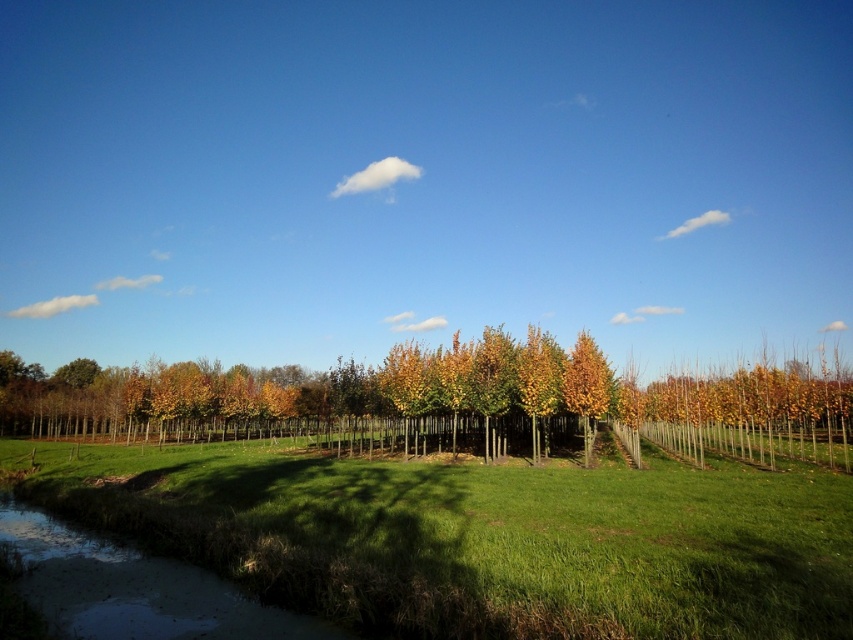
Looking at this image, is green grass at center above golden yellow leaves at center?

Yes, green grass at center is above golden yellow leaves at center.

Is point (460, 540) less distant than point (585, 333)?

That is True.

Locate an element on the screen. The height and width of the screenshot is (640, 853). green grass at center is located at coordinates (485, 536).